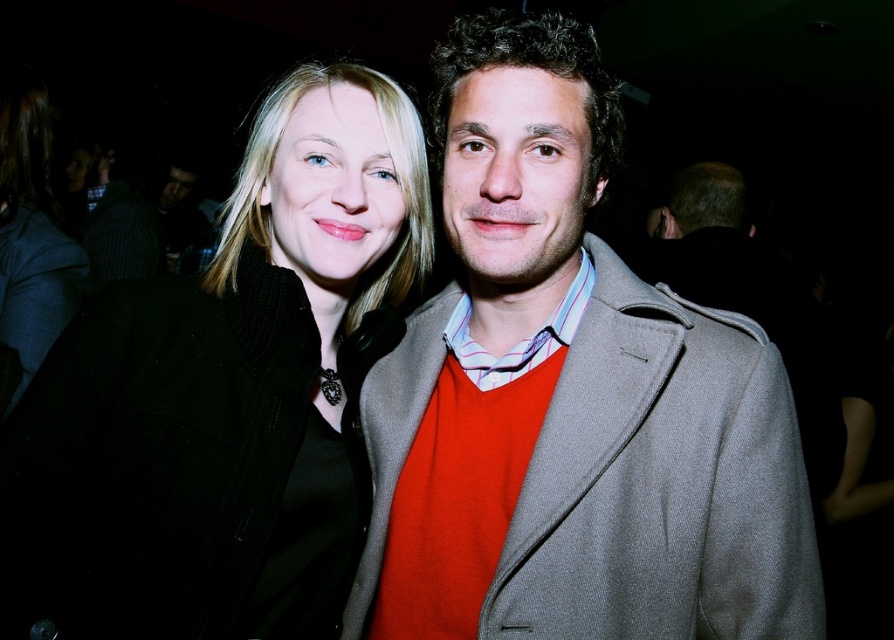
Can you confirm if matte gray coat at center is smaller than black woolen coat at left?

Indeed, matte gray coat at center has a smaller size compared to black woolen coat at left.

Locate an element on the screen. matte gray coat at center is located at coordinates (570, 397).

In the scene shown: Can you confirm if black woolen coat at left is positioned below striped fabric shirt at left?

Yes, black woolen coat at left is below striped fabric shirt at left.

Is black woolen coat at left positioned before striped fabric shirt at left?

Yes, it is in front of striped fabric shirt at left.

Is point (95, 412) farther from viewer compared to point (105, 241)?

No, it is in front of (105, 241).

Find the location of a particular element. This screenshot has height=640, width=894. black woolen coat at left is located at coordinates (226, 396).

Can you confirm if matte gray coat at center is bigger than striped fabric shirt at left?

Actually, matte gray coat at center might be smaller than striped fabric shirt at left.

Who is higher up, matte gray coat at center or striped fabric shirt at left?

striped fabric shirt at left is above.

Is point (629, 557) closer to camera compared to point (82, 236)?

That is True.

The width and height of the screenshot is (894, 640). Identify the location of matte gray coat at center. (570, 397).